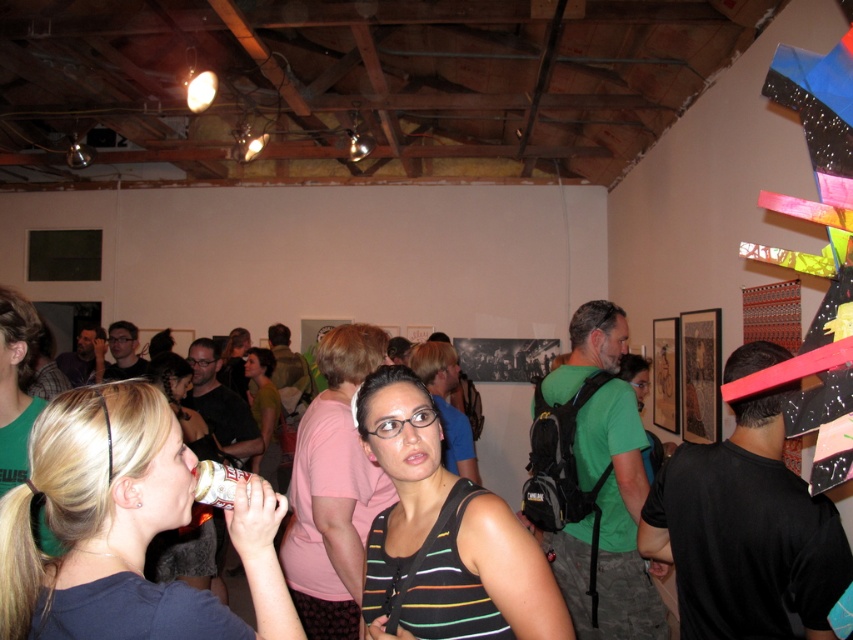
Where is the dark blue fabric at center located in the image?

The dark blue fabric at center is located at point (125, 528) in the image.

You are an attendee at the event and want to hand your white matte cup at center to the woman wearing the black striped tank top at center. Can you reach her directly without moving around other objects?

The black striped tank top at center is closer to the viewer than the white matte cup at center, so you can reach the woman wearing the black striped tank top at center directly as she is in front of the cup.